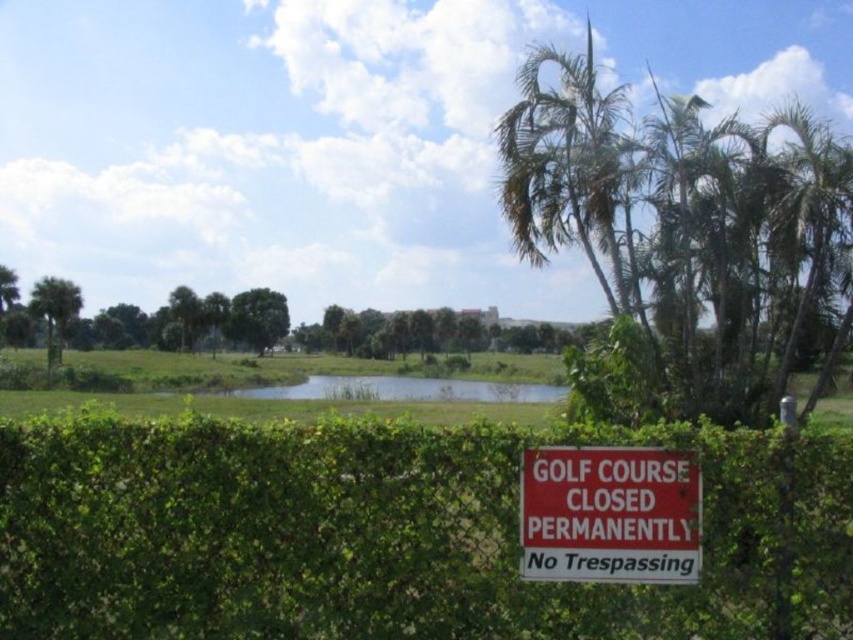
Question: Does red matte sign at lower center appear over green leafy palm tree at left?

Choices:
 (A) no
 (B) yes

Answer: (A)

Question: Is green leafy hedge at lower center smaller than green leafy palm tree at left?

Choices:
 (A) yes
 (B) no

Answer: (A)

Question: Is green leafy hedge at lower center to the right of red matte sign at lower center from the viewer's perspective?

Choices:
 (A) no
 (B) yes

Answer: (A)

Question: Which point appears closest to the camera in this image?

Choices:
 (A) (44, 288)
 (B) (621, 508)

Answer: (B)

Question: Among these points, which one is farthest from the camera?

Choices:
 (A) (466, 381)
 (B) (49, 356)
 (C) (694, 509)
 (D) (819, 566)

Answer: (A)

Question: Estimate the real-world distances between objects in this image. Which object is farther from the green leafy palm tree at left?

Choices:
 (A) green grassy flood at center
 (B) red matte sign at lower center
 (C) green leafy tree at center

Answer: (B)